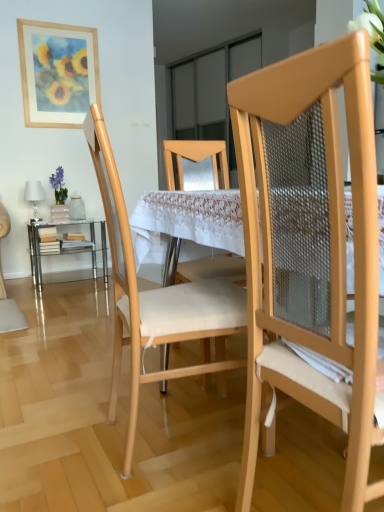
I want to click on free space in front of clear glass table at lower left, which is the 1th table from back to front, so click(68, 294).